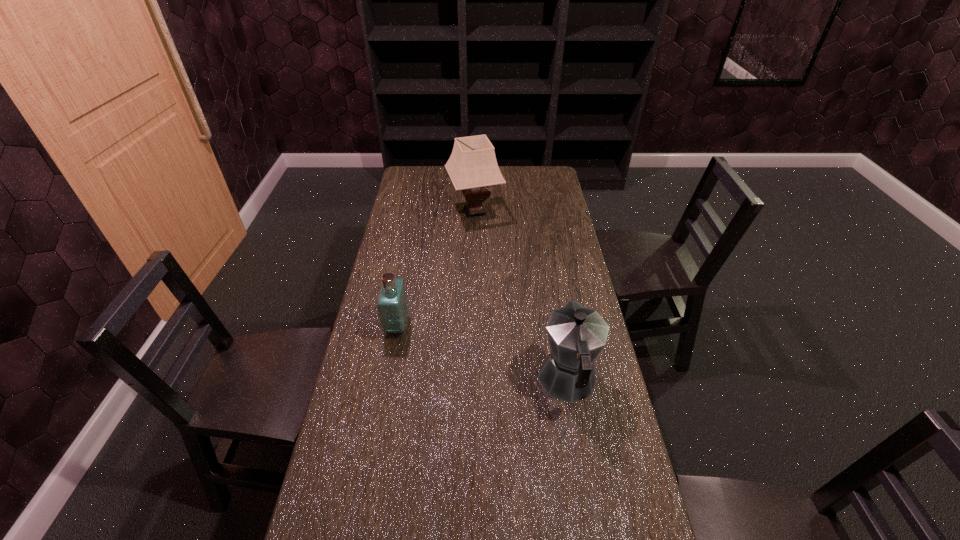
You are a GUI agent. You are given a task and a screenshot of the screen. Output one action in this format:
    pyautogui.click(x=<x>, y=<y>)
    Task: Click on the lampshade
    
    Given the screenshot: What is the action you would take?
    pyautogui.click(x=472, y=166)

Where is `the second object from left to right`? This screenshot has width=960, height=540. the second object from left to right is located at coordinates (472, 166).

Where is `the rightmost object`? Image resolution: width=960 pixels, height=540 pixels. the rightmost object is located at coordinates (576, 335).

Locate an element on the screen. the second shortest object is located at coordinates (576, 335).

Where is `perfume`? The height and width of the screenshot is (540, 960). perfume is located at coordinates (392, 307).

Where is `the shortest object`? This screenshot has width=960, height=540. the shortest object is located at coordinates (392, 307).

I want to click on vacant space positioned on the front of the farthest object, so click(473, 287).

Locate an element on the screen. This screenshot has width=960, height=540. blank area located 0.200m at the spout of the nearest object is located at coordinates (554, 302).

Find the location of a particular element. The height and width of the screenshot is (540, 960). vacant region located 0.090m at the spout of the nearest object is located at coordinates (559, 327).

Where is `free space located at the spout of the nearest object`? The width and height of the screenshot is (960, 540). free space located at the spout of the nearest object is located at coordinates (553, 299).